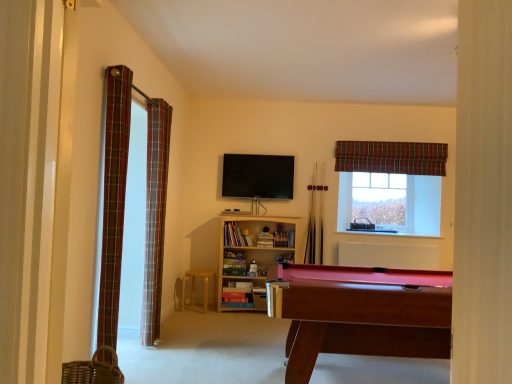
Question: Considering the relative positions of plaid fabric curtain at upper right, which is counted as the first curtain, starting from the back, and wooden pool cue at center, which appears as the 2th cue when viewed from the right, in the image provided, is plaid fabric curtain at upper right, which is counted as the first curtain, starting from the back, behind wooden pool cue at center, which appears as the 2th cue when viewed from the right,?

Choices:
 (A) no
 (B) yes

Answer: (A)

Question: Is plaid fabric curtain at upper right, arranged as the third curtain when viewed from the front, thinner than wooden pool cue at center, which appears as the 1th cue when viewed from the left?

Choices:
 (A) no
 (B) yes

Answer: (A)

Question: From the image's perspective, is plaid fabric curtain at upper right, the 1th curtain when ordered from right to left, beneath wooden pool cue at center, which appears as the 2th cue when viewed from the right?

Choices:
 (A) yes
 (B) no

Answer: (B)

Question: Is plaid fabric curtain at upper right, arranged as the third curtain when viewed from the front, bigger than wooden pool cue at center, which appears as the 2th cue when viewed from the right?

Choices:
 (A) yes
 (B) no

Answer: (A)

Question: Can you confirm if plaid fabric curtain at upper right, which is counted as the first curtain, starting from the back, is wider than wooden pool cue at center, which appears as the 1th cue when viewed from the left?

Choices:
 (A) yes
 (B) no

Answer: (A)

Question: From the image's perspective, relative to wooden bookshelf at center, is wooden pool cue at center, which appears as the 2th cue when viewed from the right, above or below?

Choices:
 (A) below
 (B) above

Answer: (B)

Question: From a real-world perspective, is wooden pool cue at center, which appears as the 2th cue when viewed from the right, positioned above or below wooden bookshelf at center?

Choices:
 (A) below
 (B) above

Answer: (B)

Question: In terms of height, does wooden pool cue at center, which appears as the 1th cue when viewed from the left, look taller or shorter compared to wooden bookshelf at center?

Choices:
 (A) tall
 (B) short

Answer: (A)

Question: Would you say wooden pool cue at center, which appears as the 2th cue when viewed from the right, is inside or outside wooden bookshelf at center?

Choices:
 (A) outside
 (B) inside

Answer: (A)

Question: Considering the positions of plaid fabric curtain at left, the first curtain when ordered from left to right, and plaid fabric curtain at left, which is the 2th curtain from right to left, in the image, is plaid fabric curtain at left, the first curtain when ordered from left to right, taller or shorter than plaid fabric curtain at left, which is the 2th curtain from right to left,?

Choices:
 (A) tall
 (B) short

Answer: (B)

Question: Is plaid fabric curtain at left, the first curtain when ordered from left to right, in front of or behind plaid fabric curtain at left, the second curtain in the left-to-right sequence, in the image?

Choices:
 (A) front
 (B) behind

Answer: (A)

Question: Is plaid fabric curtain at left, positioned as the 3th curtain in right-to-left order, inside or outside of plaid fabric curtain at left, which is the 2th curtain from right to left?

Choices:
 (A) inside
 (B) outside

Answer: (B)

Question: From a real-world perspective, is plaid fabric curtain at left, the first curtain positioned from the front, positioned above or below plaid fabric curtain at left, which is the second curtain in back-to-front order?

Choices:
 (A) below
 (B) above

Answer: (A)

Question: From a real-world perspective, is flat screen tv at center above or below wooden pool cue at center, which appears as the 2th cue when viewed from the right?

Choices:
 (A) above
 (B) below

Answer: (A)

Question: In the image, is flat screen tv at center positioned in front of or behind wooden pool cue at center, which appears as the 2th cue when viewed from the right?

Choices:
 (A) behind
 (B) front

Answer: (B)